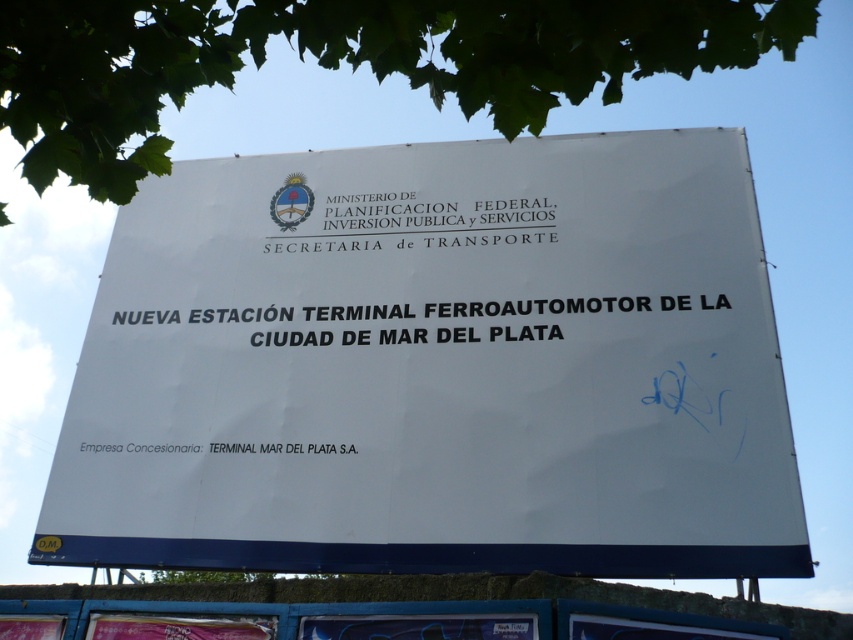
Question: Can you confirm if white paper sign at center is positioned above black text at center?

Choices:
 (A) yes
 (B) no

Answer: (B)

Question: Which object is closer to the camera taking this photo?

Choices:
 (A) white paper sign at center
 (B) green leafy tree at upper center
 (C) black text at center

Answer: (B)

Question: Can you confirm if green leafy tree at upper center is wider than black text at center?

Choices:
 (A) no
 (B) yes

Answer: (A)

Question: Which object appears farthest from the camera in this image?

Choices:
 (A) green leafy tree at upper center
 (B) black text at center
 (C) white paper at upper center
 (D) white paper sign at center

Answer: (C)

Question: Which object appears closest to the camera in this image?

Choices:
 (A) green leafy tree at upper center
 (B) white paper sign at center
 (C) black text at center

Answer: (A)

Question: Can you confirm if white paper sign at center is thinner than green leafy tree at upper center?

Choices:
 (A) no
 (B) yes

Answer: (A)